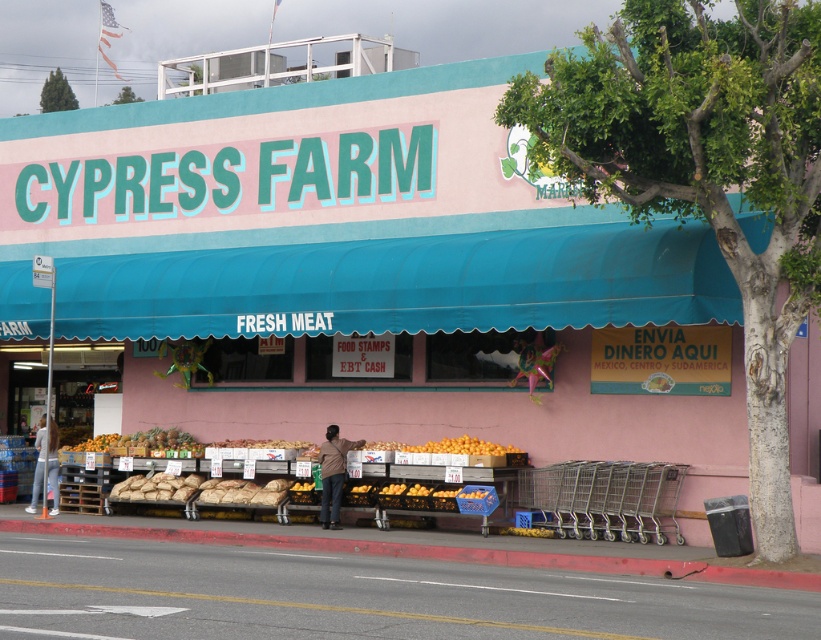
You are a customer looking at the storefront of Cypress Farm. You see an orange matte fruit at center and a shiny golden pineapple at center. Which fruit is bigger?

The orange matte fruit at center is larger in size compared to the shiny golden pineapple at center.

You are a customer standing in front of the Cypress Farm grocery store. You see an orange matte fruit at center and a shiny golden pineapple at center displayed in the window. If you want to pick both items, which one should you reach for first considering their positions?

Both the orange matte fruit at center and the shiny golden pineapple at center are displayed 22.65 feet apart in the storefront window. Since they are positioned at the same central area, you can reach for either one first as their distance from you is similar.